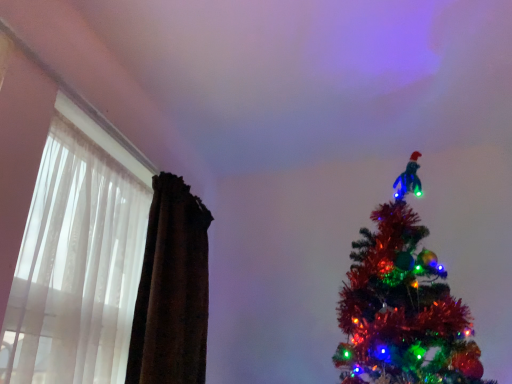
At what (x,y) coordinates should I click in order to perform the action: click on translucent fabric at left. Please return your answer as a coordinate pair (x, y). Looking at the image, I should click on (77, 259).

In the scene shown: What is the approximate width of translucent fabric at left?

It is 5.06 inches.

The height and width of the screenshot is (384, 512). What do you see at coordinates (77, 259) in the screenshot? I see `translucent fabric at left` at bounding box center [77, 259].

The image size is (512, 384). What do you see at coordinates (172, 290) in the screenshot?
I see `brown velvet curtain at left` at bounding box center [172, 290].

The height and width of the screenshot is (384, 512). I want to click on brown velvet curtain at left, so click(172, 290).

Identify the location of translucent fabric at left. pyautogui.click(x=77, y=259).

Can you confirm if brown velvet curtain at left is positioned to the right of translucent fabric at left?

Yes.

Which object is further away from the camera taking this photo, brown velvet curtain at left or translucent fabric at left?

brown velvet curtain at left.

In the scene shown: Which point is more distant from viewer, (202, 325) or (48, 242)?

The point (202, 325) is farther.

From the image's perspective, relative to translucent fabric at left, is brown velvet curtain at left above or below?

Based on their image positions, brown velvet curtain at left is located beneath translucent fabric at left.

From a real-world perspective, relative to translucent fabric at left, is brown velvet curtain at left vertically above or below?

In terms of real-world spatial position, brown velvet curtain at left is above translucent fabric at left.

Looking at their sizes, would you say brown velvet curtain at left is wider or thinner than translucent fabric at left?

brown velvet curtain at left is wider than translucent fabric at left.

Who is taller, brown velvet curtain at left or translucent fabric at left?

brown velvet curtain at left is taller.

Based on the photo, can you confirm if brown velvet curtain at left is smaller than translucent fabric at left?

No.

Is translucent fabric at left surrounded by brown velvet curtain at left?

Definitely not — translucent fabric at left is not inside brown velvet curtain at left.

Is brown velvet curtain at left far away from translucent fabric at left?

No.

Is translucent fabric at left at the back of brown velvet curtain at left?

That's not correct — brown velvet curtain at left is not looking away from translucent fabric at left.

How many degrees apart are the facing directions of brown velvet curtain at left and translucent fabric at left?

brown velvet curtain at left and translucent fabric at left are facing 0.00149 degrees away from each other.

Find the location of a particular element. window above the brown velvet curtain at left (from the image's perspective) is located at coordinates (77, 259).

Based on their positions, is translucent fabric at left located to the left or right of brown velvet curtain at left?

translucent fabric at left is positioned on brown velvet curtain at left's left side.

Which object is closer to the camera taking this photo, translucent fabric at left or brown velvet curtain at left?

Positioned in front is translucent fabric at left.

Considering the positions of points (72, 233) and (180, 309), is point (72, 233) closer to camera compared to point (180, 309)?

Yes.

From the image's perspective, which is below, translucent fabric at left or brown velvet curtain at left?

brown velvet curtain at left appears lower in the image.

From a real-world perspective, is translucent fabric at left positioned over brown velvet curtain at left based on gravity?

No.

Which of these two, translucent fabric at left or brown velvet curtain at left, is thinner?

translucent fabric at left is thinner.

Is translucent fabric at left taller or shorter than brown velvet curtain at left?

Clearly, translucent fabric at left is shorter compared to brown velvet curtain at left.

Considering the sizes of objects translucent fabric at left and brown velvet curtain at left in the image provided, who is bigger, translucent fabric at left or brown velvet curtain at left?

With larger size is brown velvet curtain at left.

Is translucent fabric at left not inside brown velvet curtain at left?

That's correct, translucent fabric at left is outside of brown velvet curtain at left.

Is there a large distance between translucent fabric at left and brown velvet curtain at left?

translucent fabric at left is near brown velvet curtain at left, not far away.

Is translucent fabric at left looking in the opposite direction of brown velvet curtain at left?

translucent fabric at left is not turned away from brown velvet curtain at left.

How different are the orientations of translucent fabric at left and brown velvet curtain at left in degrees?

There is a 0.00149-degree angle between the facing directions of translucent fabric at left and brown velvet curtain at left.

There is a translucent fabric at left. Identify the location of curtain above it (from a real-world perspective). The height and width of the screenshot is (384, 512). (172, 290).

Identify the location of curtain behind the translucent fabric at left. (172, 290).

In the image, there is a translucent fabric at left. In order to click on curtain below it (from the image's perspective) in this screenshot , I will do `click(172, 290)`.